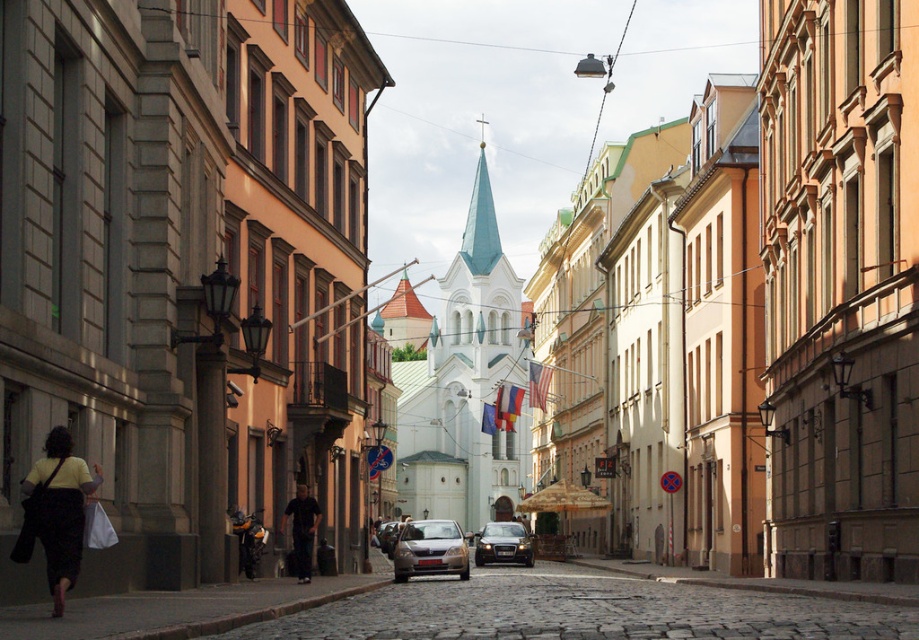
You are a photographer standing on the charming urban street scene. You want to capture both the matte yellow shirt at lower left and the satin black car at center in a single shot. Which object will appear smaller in the photo?

The matte yellow shirt at lower left will appear smaller in the photo because it has a smaller size compared to the satin black car at center.